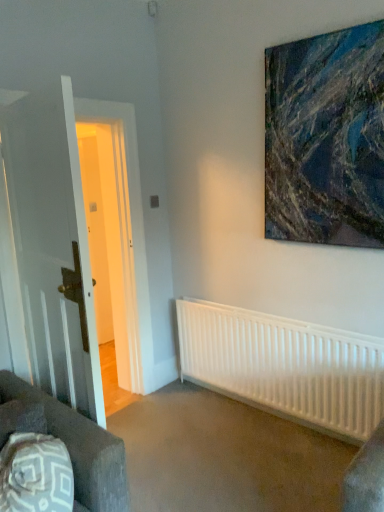
Question: Does abstract painting at upper right have a smaller size compared to dark brown fabric couch at lower left?

Choices:
 (A) yes
 (B) no

Answer: (A)

Question: Is abstract painting at upper right aimed at dark brown fabric couch at lower left?

Choices:
 (A) no
 (B) yes

Answer: (B)

Question: Does abstract painting at upper right have a larger size compared to dark brown fabric couch at lower left?

Choices:
 (A) yes
 (B) no

Answer: (B)

Question: From the image's perspective, is abstract painting at upper right below dark brown fabric couch at lower left?

Choices:
 (A) no
 (B) yes

Answer: (A)

Question: From the image's perspective, is abstract painting at upper right located above dark brown fabric couch at lower left?

Choices:
 (A) yes
 (B) no

Answer: (A)

Question: In the image, is white wooden door at left positioned in front of or behind dark brown fabric couch at lower left?

Choices:
 (A) behind
 (B) front

Answer: (A)

Question: From a real-world perspective, is white wooden door at left positioned above or below dark brown fabric couch at lower left?

Choices:
 (A) above
 (B) below

Answer: (A)

Question: Would you say white wooden door at left is to the left or to the right of dark brown fabric couch at lower left in the picture?

Choices:
 (A) right
 (B) left

Answer: (B)

Question: Is point (13, 174) positioned closer to the camera than point (74, 425)?

Choices:
 (A) farther
 (B) closer

Answer: (A)

Question: Considering the relative positions of abstract painting at upper right and dark brown fabric couch at lower left in the image provided, is abstract painting at upper right to the left or to the right of dark brown fabric couch at lower left?

Choices:
 (A) right
 (B) left

Answer: (A)

Question: Looking at the image, does abstract painting at upper right seem bigger or smaller compared to dark brown fabric couch at lower left?

Choices:
 (A) small
 (B) big

Answer: (A)

Question: Considering the positions of abstract painting at upper right and dark brown fabric couch at lower left in the image, is abstract painting at upper right wider or thinner than dark brown fabric couch at lower left?

Choices:
 (A) wide
 (B) thin

Answer: (B)

Question: From a real-world perspective, is abstract painting at upper right physically located above or below dark brown fabric couch at lower left?

Choices:
 (A) below
 (B) above

Answer: (B)

Question: In terms of size, does white wooden door at left appear bigger or smaller than abstract painting at upper right?

Choices:
 (A) big
 (B) small

Answer: (A)

Question: Is point (13, 177) positioned closer to the camera than point (350, 245)?

Choices:
 (A) farther
 (B) closer

Answer: (B)